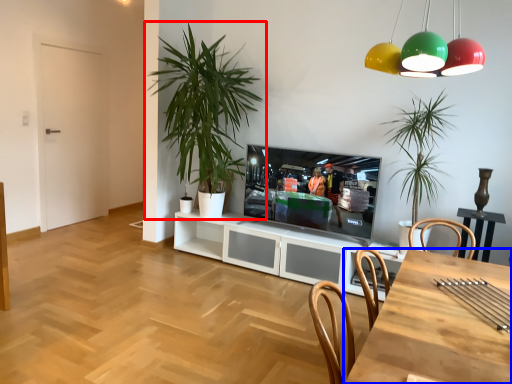
Question: Which point is closer to the camera, houseplant (highlighted by a red box) or desk (highlighted by a blue box)?

Choices:
 (A) houseplant
 (B) desk

Answer: (B)